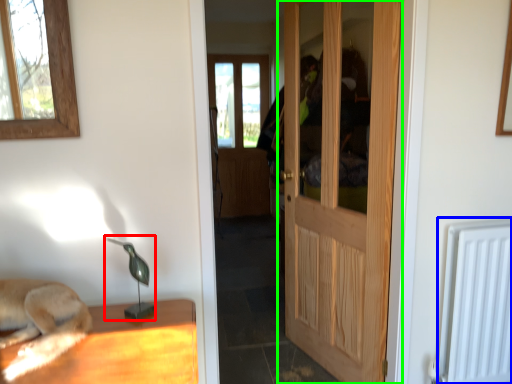
Question: Which is farther away from table lamp (highlighted by a red box)? radiator (highlighted by a blue box) or door (highlighted by a green box)?

Choices:
 (A) radiator
 (B) door

Answer: (A)